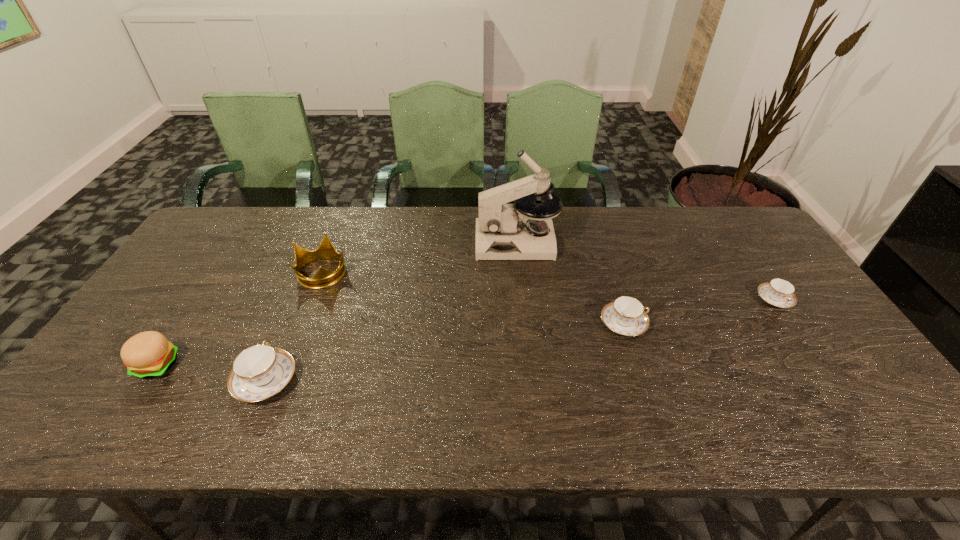
Identify the location of location for an additional teacup to make spacing equal. (455, 350).